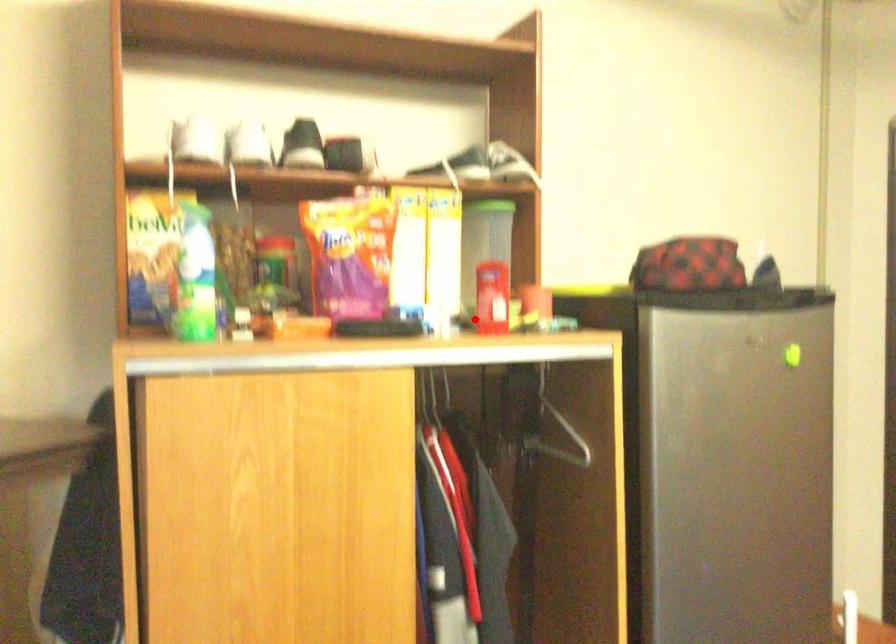
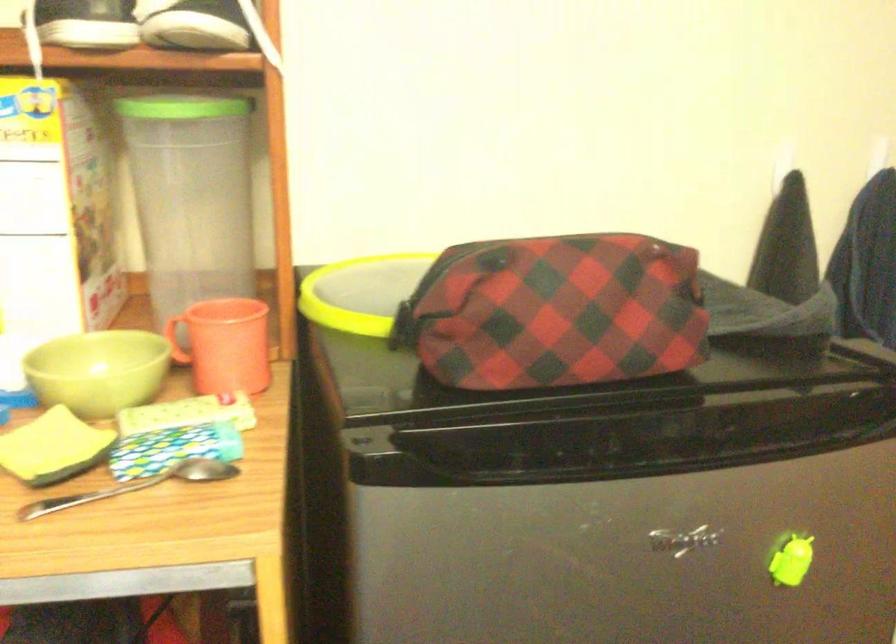
Question: I am providing you with two images of the same scene from different viewpoints. In image1, a red point is highlighted. Considering the same 3D point in image2, which of the following is correct?

Choices:
 (A) It is closer
 (B) It is farther

Answer: (A)